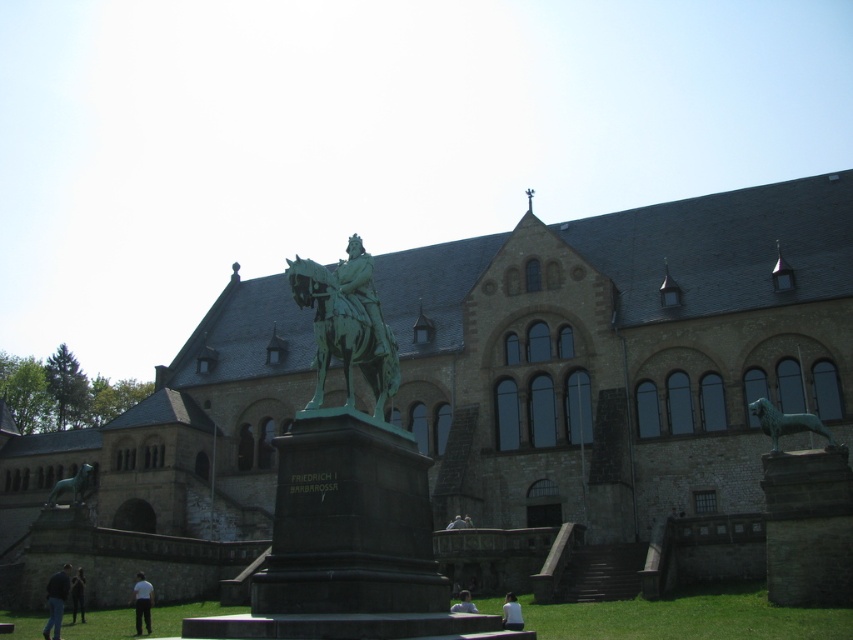
You are a tour guide explaining the historical significance of the building and its statue. You notice two visitors wearing a white cotton shirt at lower left and a light blue shirt at lower center. Which visitor is closer to the statue?

The white cotton shirt at lower left is closer to the statue because the light blue shirt at lower center is positioned behind it.

You are an art conservator assessing the placement of the green polished bronze statue at center and the light blue shirt at lower center in the image. Based on their spatial relationship, which object takes up more area in the image?

The light blue shirt at lower center takes up more area in the image than the green polished bronze statue at center because the statue occupies less space than the shirt according to the description.